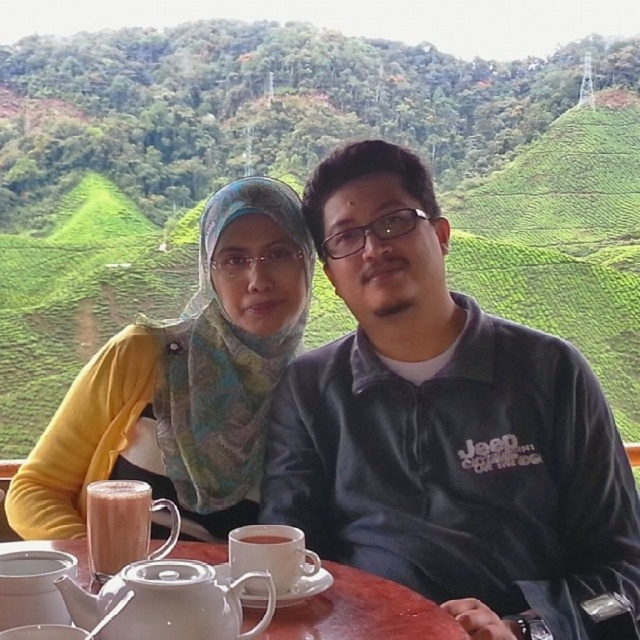
You are a waiter at this outdoor table. You need to place a new order for the customer seated at the white ceramic saucer at center. Where should you place the order relative to the matte pink beverage at lower left?

Place the order to the right of the matte pink beverage at lower left, as the white ceramic saucer at center is already positioned to its right.

You are a waiter at this outdoor table. You need to place a new dessert plate that is 10 cm in diameter. Which object, the matte pink beverage at lower left or the white ceramic saucer at center, would be a better fit for placing the dessert plate next to without overlapping?

The white ceramic saucer at center has a larger width than the matte pink beverage at lower left, so placing the dessert plate next to the white ceramic saucer at center would provide more space and avoid overlapping.

You are a person sitting at the white ceramic table at center. You want to reach the matte pink beverage at lower left without moving your chair. Can you easily reach it based on their heights?

The white ceramic table at center has a lesser height compared to matte pink beverage at lower left, meaning the beverage is taller than the table. Since the beverage is placed on the table, its height would be above the table surface. Therefore, you can easily reach it without moving your chair.